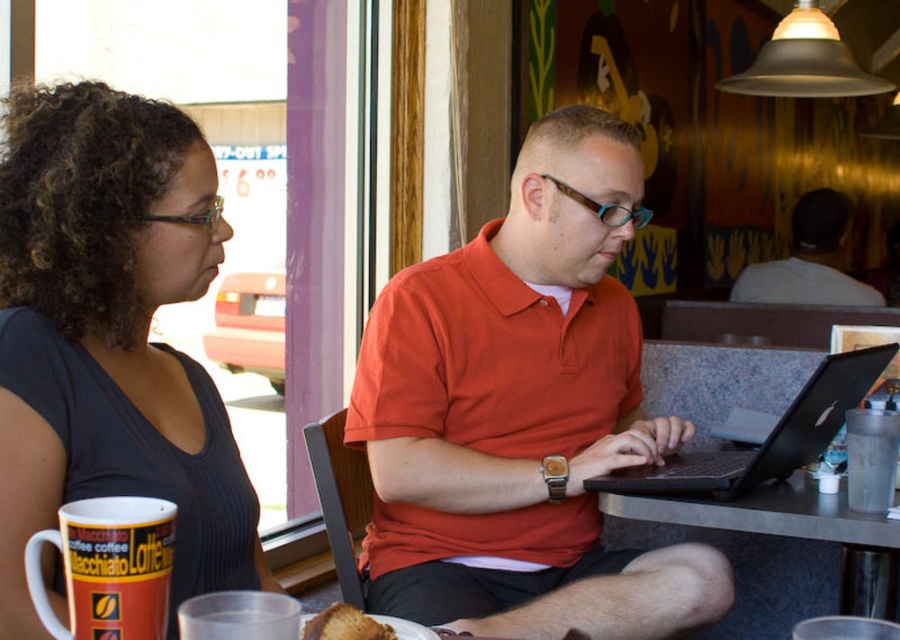
You are trying to place a large plate of food on the table. Given the objects present, will the black granite table at center have enough space for the plate next to the black matte laptop at center?

The black granite table at center is larger in size than the black matte laptop at center, so there should be sufficient space to place the plate next to the laptop.

You are trying to place a large plate of food on the table. Given the size of the black granite table at center and the white matte shirt at upper right, which object would be more suitable to place the plate on?

The black granite table at center is more suitable to place the large plate of food on because it has a larger size compared to the white matte shirt at upper right.